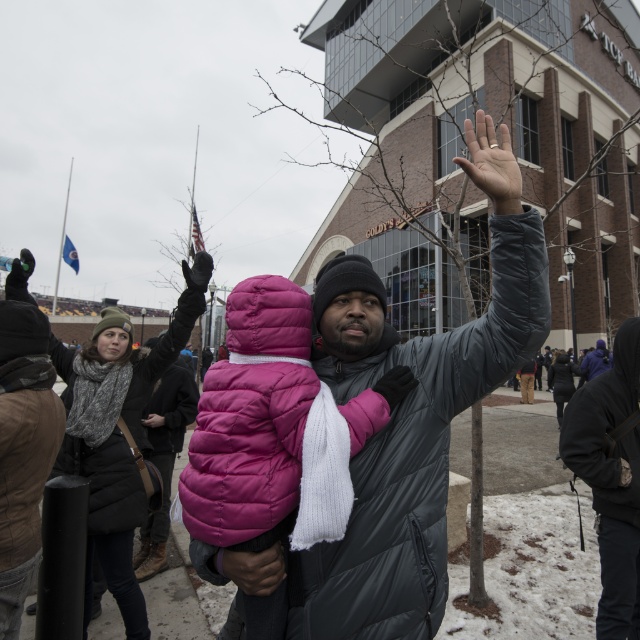
Between matte black hand at upper center and black matte glove at upper center, which one has more height?

matte black hand at upper center is taller.

Can you confirm if matte black hand at upper center is thinner than black matte glove at upper center?

In fact, matte black hand at upper center might be wider than black matte glove at upper center.

Which is behind, point (488, 186) or point (410, 388)?

Point (410, 388)

Where is `matte black hand at upper center`? This screenshot has width=640, height=640. matte black hand at upper center is located at coordinates 492,163.

Consider the image. Can you confirm if dark gray hooded jacket at lower right is positioned below black matte glove at upper center?

Yes.

Between point (625, 472) and point (394, 390), which one is positioned in front?

Positioned in front is point (394, 390).

Between point (620, 596) and point (374, 387), which one is positioned behind?

Positioned behind is point (620, 596).

You are a GUI agent. You are given a task and a screenshot of the screen. Output one action in this format:
    pyautogui.click(x=<x>, y=<y>)
    Task: Click on the dark gray hooded jacket at lower right
    Image resolution: width=640 pixels, height=640 pixels.
    Given the screenshot: What is the action you would take?
    pyautogui.click(x=611, y=477)

Who is more distant from viewer, (483, 118) or (150, 426)?

Positioned behind is point (150, 426).

Can you confirm if matte black hand at upper center is wider than black matte glove at upper left?

Correct, the width of matte black hand at upper center exceeds that of black matte glove at upper left.

Image resolution: width=640 pixels, height=640 pixels. What are the coordinates of `matte black hand at upper center` in the screenshot? It's located at (492, 163).